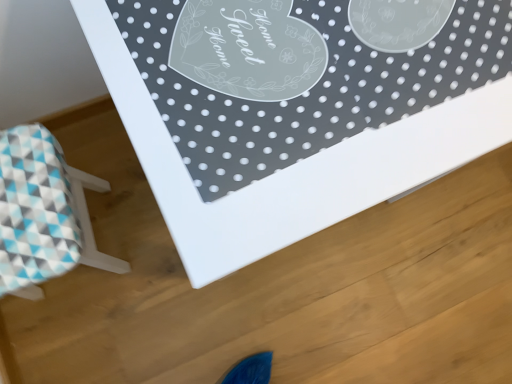
Where is `free location to the right of blue checkered stool at lower left`? This screenshot has height=384, width=512. free location to the right of blue checkered stool at lower left is located at coordinates coord(156,288).